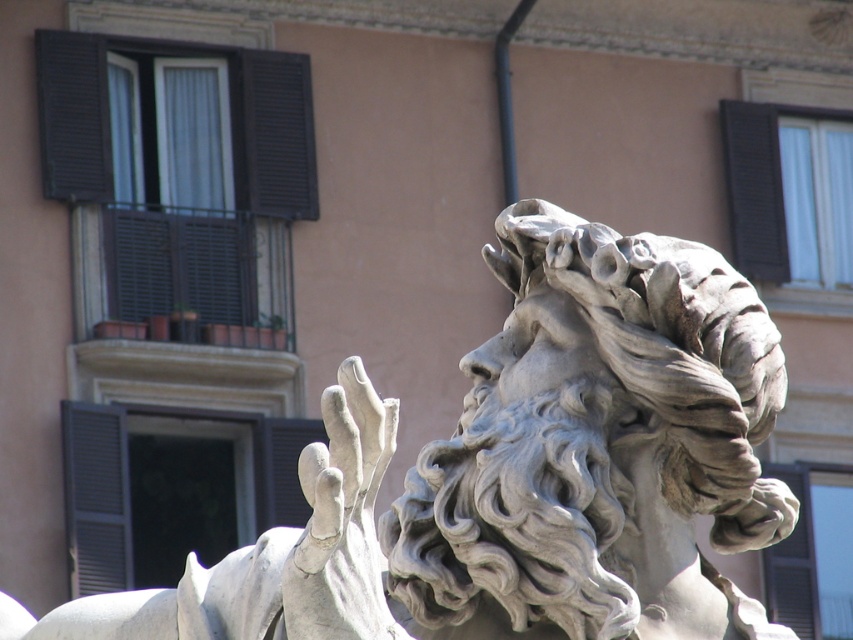
You are an art student analyzing the composition of the image. You notice the white marble statue at upper center and the black matte shutter at upper right. Based on their positions, which object is closer to the left side of the image?

The white marble statue at upper center is closer to the left side of the image because it is positioned to the left of the black matte shutter at upper right.

You are standing in front of the classical stone sculpture and want to touch both the point at location (308, 502) and the point at (839, 118) on the sculpture. Which point will you reach first with your hand?

The point at location (308, 502) is closer to the viewer than the point at (839, 118), so you will reach it first.

You are an art student who wants to sketch the white marble statue at upper center. You are standing at the lower left corner of the image. To get a clear view of the statue, should you move towards the right or left side of the image?

Since the white marble statue at upper center is located at point (x=525, y=472), which is closer to the right side of the image, you should move towards the right side to get a clearer view.